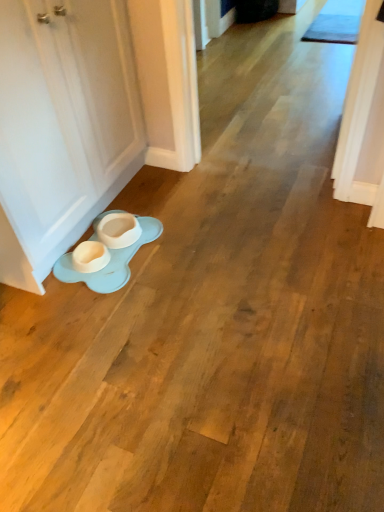
Where is `blank space situated above light blue rubber saucer at lower left (from a real-world perspective)`? blank space situated above light blue rubber saucer at lower left (from a real-world perspective) is located at coordinates (123, 247).